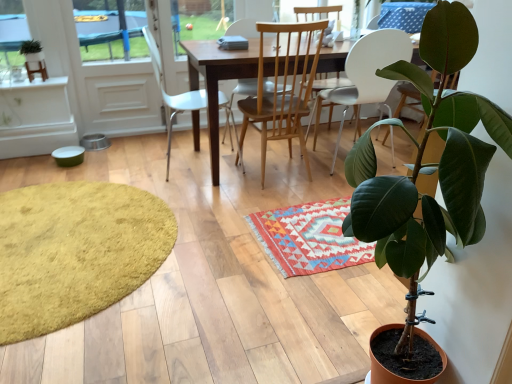
This screenshot has height=384, width=512. In order to click on empty space that is in between yellow shaggy rug at lower left, which ranks as the 1th mat in left-to-right order, and multicolored woven rug at center, marked as the 2th mat in a left-to-right arrangement in this screenshot , I will do coord(240,218).